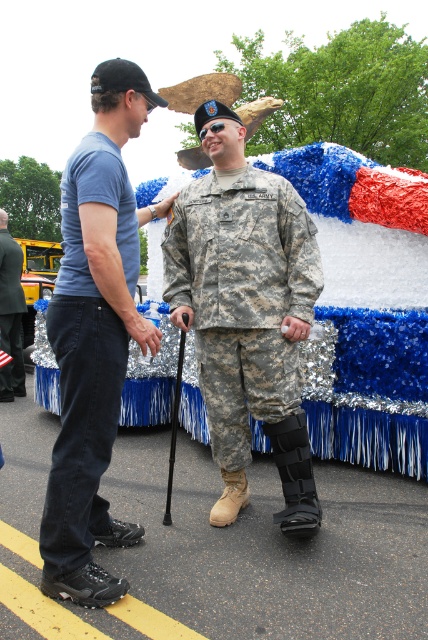
Consider the image. You are a photographer at the event and want to capture both the blue denim jeans at left and the brushed metal cane at left in the same frame. Which object should you focus on first to ensure both are in the frame?

Result: Since the blue denim jeans at left is bigger than the brushed metal cane at left, you should focus on the blue denim jeans at left first to ensure both objects fit in the frame.